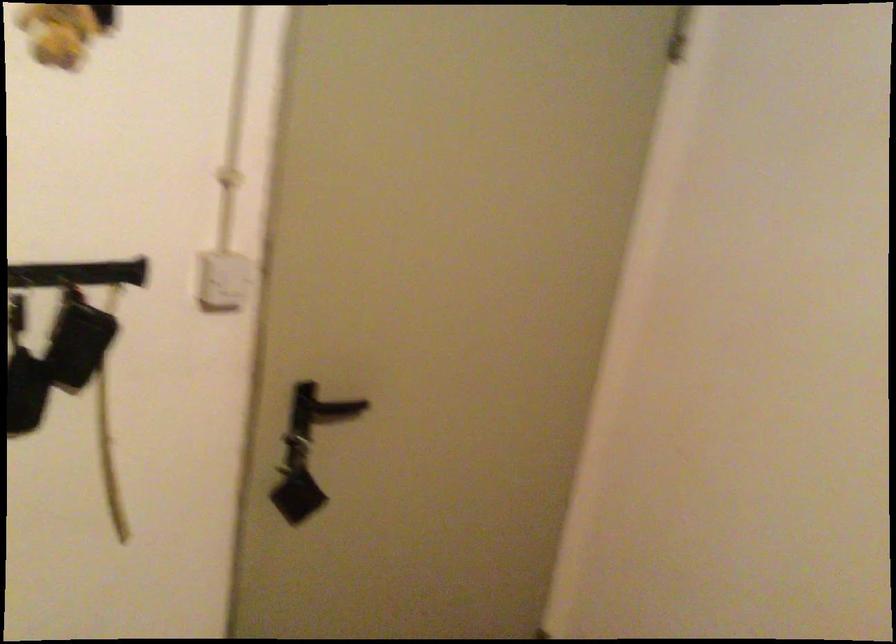
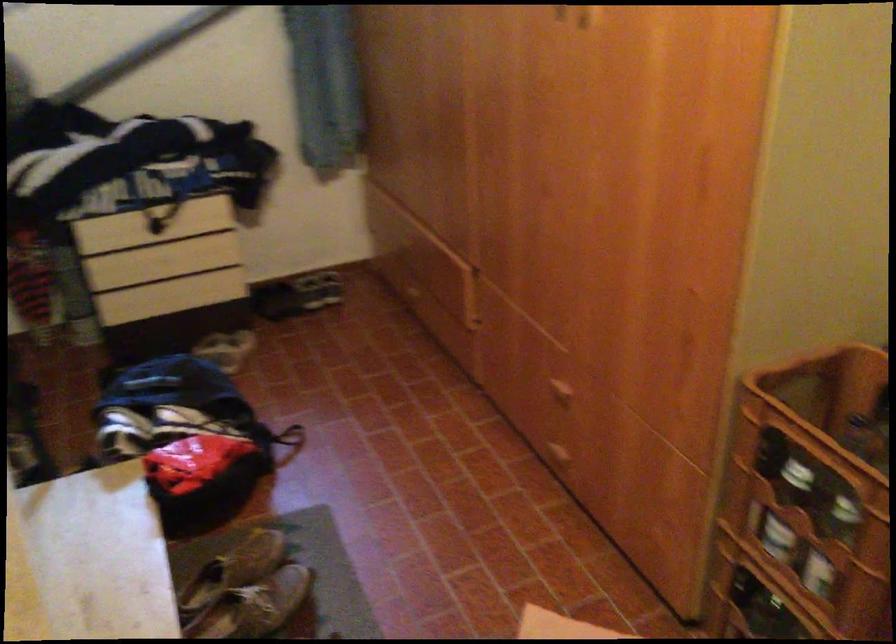
The first image is from the beginning of the video and the second image is from the end. How did the camera likely rotate when shooting the video?

The camera's rotation is toward left-down.